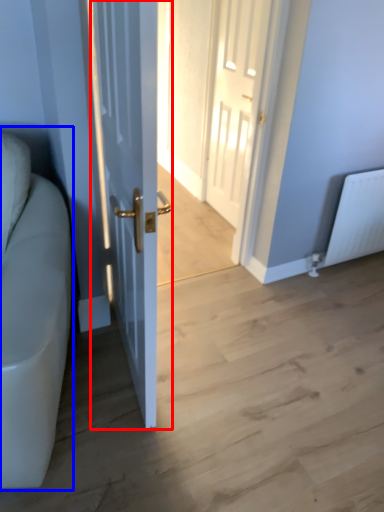
Question: Among these objects, which one is farthest to the camera, door (highlighted by a red box) or couch (highlighted by a blue box)?

Choices:
 (A) door
 (B) couch

Answer: (A)